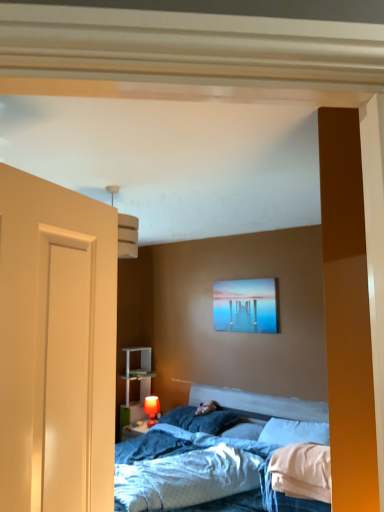
Question: Is point (130, 416) positioned closer to the camera than point (253, 313)?

Choices:
 (A) farther
 (B) closer

Answer: (A)

Question: In terms of width, does white plastic shelf at lower left look wider or thinner when compared to matte acrylic painting at upper center?

Choices:
 (A) thin
 (B) wide

Answer: (B)

Question: Which of these objects is positioned closest to the matte acrylic painting at upper center?

Choices:
 (A) white soft pillow at center, which is counted as the second pillow, starting from the left
 (B) blue textured sheet at center
 (C) white soft pillow at center, the 1th pillow from the right
 (D) blue soft pillow at center, which is counted as the third pillow, starting from the right
 (E) matte red table lamp at lower center

Answer: (D)

Question: Estimate the real-world distances between objects in this image. Which object is closer to the matte red table lamp at lower center?

Choices:
 (A) white plastic shelf at lower left
 (B) blue textured sheet at center
 (C) white soft pillow at center, the 2th pillow from the right
 (D) white soft pillow at center, the 1th pillow from the right
 (E) blue soft pillow at center, the 1th pillow from the left

Answer: (A)